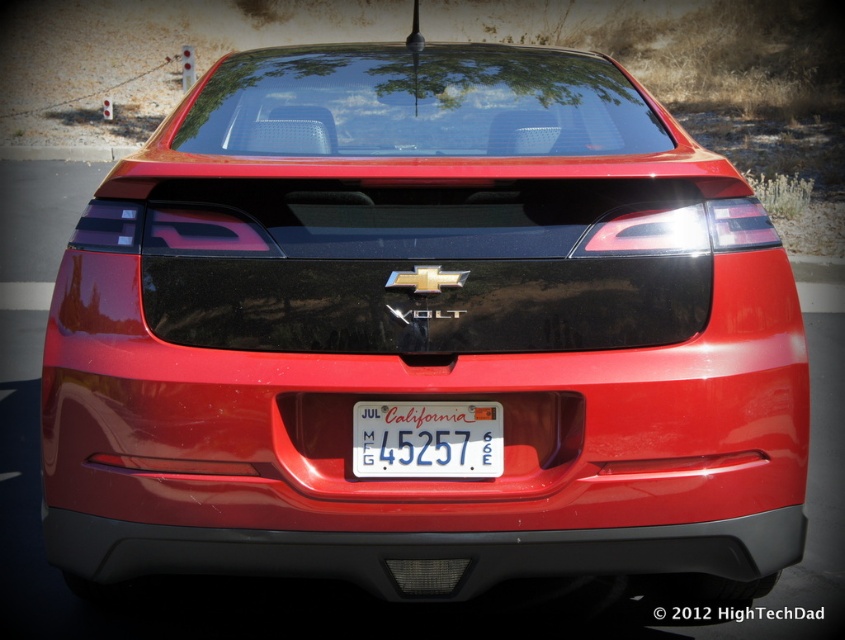
How distant is matte black bumper at lower center from white plastic license plate at center?

matte black bumper at lower center and white plastic license plate at center are 11.64 inches apart.

Can you confirm if matte black bumper at lower center is taller than white plastic license plate at center?

Yes.

Image resolution: width=845 pixels, height=640 pixels. In order to click on matte black bumper at lower center in this screenshot , I will do `click(424, 552)`.

Locate an element on the screen. The width and height of the screenshot is (845, 640). matte black bumper at lower center is located at coordinates (424, 552).